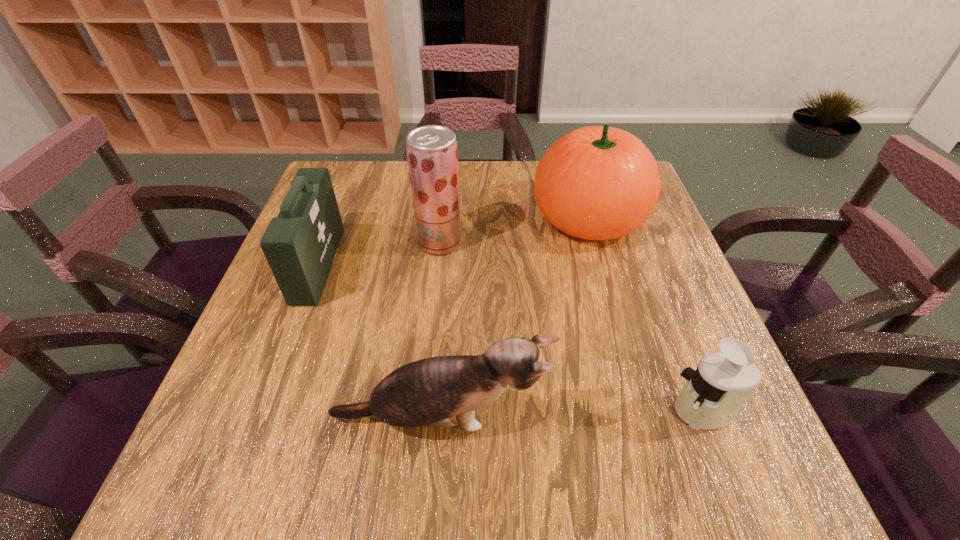
Locate an element on the screen. This screenshot has width=960, height=540. unoccupied area between the cat and the first-aid kit is located at coordinates (379, 341).

Identify which object is the fourth closest to the juicer. Please provide its 2D coordinates. Your answer should be formatted as a tuple, i.e. [(x, y)], where the tuple contains the x and y coordinates of a point satisfying the conditions above.

[(300, 244)]

At what (x,y) coordinates should I click in order to perform the action: click on object that is the fourth nearest to the fruit juice. Please return your answer as a coordinate pair (x, y). Looking at the image, I should click on (713, 395).

The image size is (960, 540). Identify the location of blank area in the image that satisfies the following two spatial constraints: 1. on the back side of the juicer; 2. on the front-facing side of the leftmost object. (647, 265).

Locate an element on the screen. Image resolution: width=960 pixels, height=540 pixels. vacant position in the image that satisfies the following two spatial constraints: 1. on the front side of the juicer; 2. on the left side of the fruit juice is located at coordinates (423, 411).